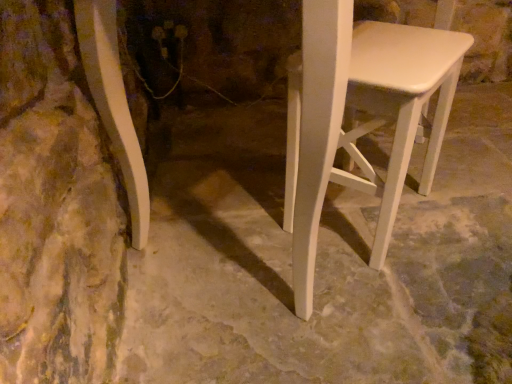
Locate an element on the screen. This screenshot has width=512, height=384. free space in front of white matte stool at right is located at coordinates (391, 305).